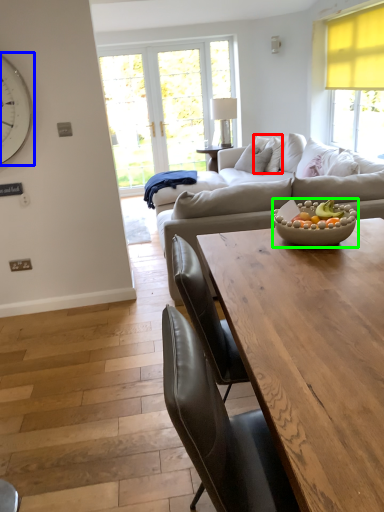
Question: Based on their relative distances, which object is farther from pillow (highlighted by a red box)? Choose from clock (highlighted by a blue box) and bowl (highlighted by a green box).

Choices:
 (A) clock
 (B) bowl

Answer: (A)